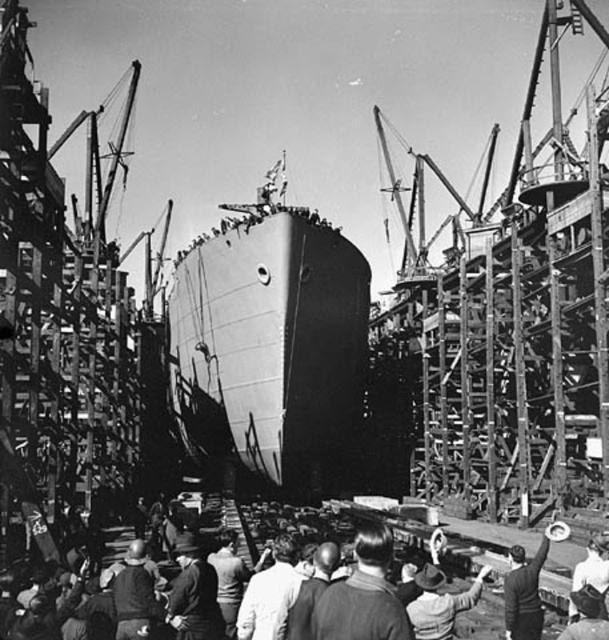
Is point (535, 595) positioned after point (594, 637)?

That is True.

Between white cloth hat at center and dark brown leather hat at center, which one is positioned higher?

white cloth hat at center is higher up.

At what (x,y) coordinates should I click in order to perform the action: click on white cloth hat at center. Please return your answer as a coordinate pair (x, y). Looking at the image, I should click on (527, 586).

Locate an element on the screen. This screenshot has width=609, height=640. white cloth hat at center is located at coordinates (527, 586).

Between smooth gray ship at center and white cloth hat at center, which one has more height?

Standing taller between the two is smooth gray ship at center.

Identify the location of smooth gray ship at center. This screenshot has height=640, width=609. (276, 339).

Does dark clothing crowd at lower left have a larger size compared to dark gray shirt at center?

Indeed, dark clothing crowd at lower left has a larger size compared to dark gray shirt at center.

Is dark clothing crowd at lower left taller than dark gray shirt at center?

In fact, dark clothing crowd at lower left may be shorter than dark gray shirt at center.

Between point (547, 561) and point (389, 593), which one is positioned behind?

Point (547, 561)

Locate an element on the screen. The image size is (609, 640). dark clothing crowd at lower left is located at coordinates (482, 545).